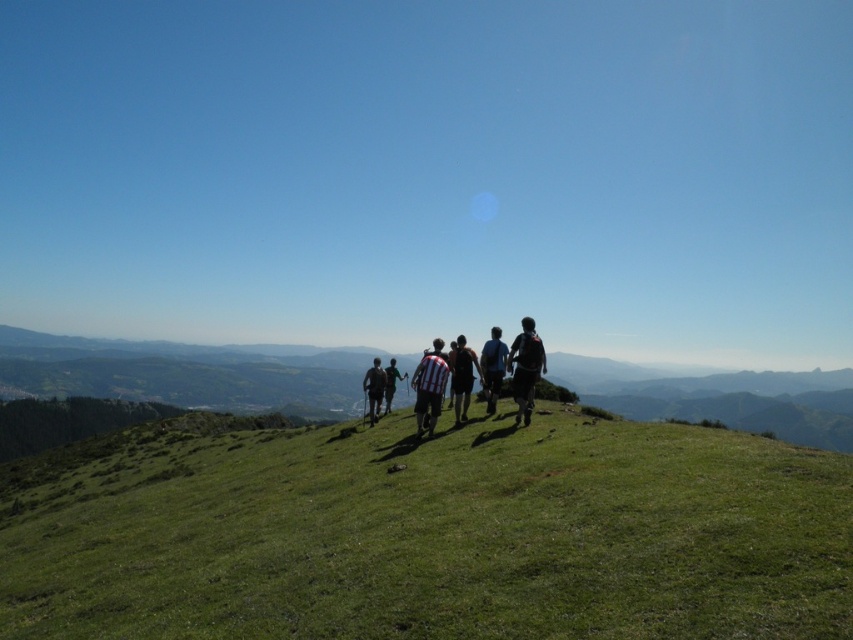
You are a hiker who wants to know if your dark blue backpack at center can fit through a narrow trail passage that your black fabric backpack at center can already pass through. Can it?

The dark blue backpack at center might be wider than black fabric backpack at center, so it may not fit through the passage that the black fabric backpack at center can pass through.

You are a hiker trying to decide where to place your dark gray backpack at center so it doesn not get buried by the green grassy hillside at center. Based on the scene, which object is larger and should you place the backpack to the side of it or behind it?

The green grassy hillside at center is bigger than the dark gray backpack at center. To prevent the backpack from being buried, you should place it to the side of the green grassy hillside at center since it is larger.

In the scene shown: You are a hiker standing at the starting point and see the green grassy hillside at center and the striped jersey at center ahead of you. Which object is closer to you?

The striped jersey at center is closer because it is only 7.98 meters away from the green grassy hillside at center, which is further away.